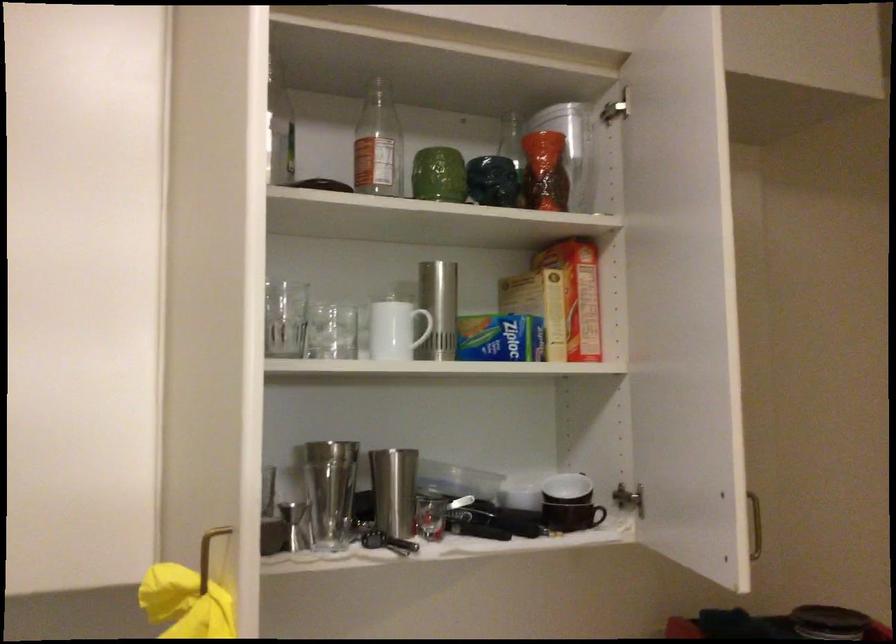
The location [377,144] corresponds to which object?

This point indicates the clear glass bottle.